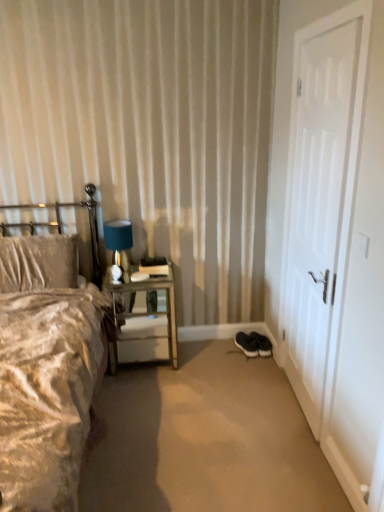
Question: Can we say white matte door at right lies outside metallic silver nightstand at left?

Choices:
 (A) no
 (B) yes

Answer: (B)

Question: From a real-world perspective, is white matte door at right under metallic silver nightstand at left?

Choices:
 (A) no
 (B) yes

Answer: (A)

Question: From a real-world perspective, is white matte door at right positioned over metallic silver nightstand at left based on gravity?

Choices:
 (A) no
 (B) yes

Answer: (B)

Question: Is the position of white matte door at right less distant than that of metallic silver nightstand at left?

Choices:
 (A) yes
 (B) no

Answer: (A)

Question: Does white matte door at right have a lesser height compared to metallic silver nightstand at left?

Choices:
 (A) yes
 (B) no

Answer: (B)

Question: Is black rubber shoes at lower right to the left or to the right of black suede sneakers at lower right, positioned as the first footwear in left-to-right order, in the image?

Choices:
 (A) left
 (B) right

Answer: (A)

Question: Is point (183, 499) positioned closer to the camera than point (243, 352)?

Choices:
 (A) farther
 (B) closer

Answer: (B)

Question: Is black rubber shoes at lower right in front of or behind black suede sneakers at lower right, positioned as the first footwear in left-to-right order, in the image?

Choices:
 (A) front
 (B) behind

Answer: (A)

Question: Choose the correct answer: Is black rubber shoes at lower right inside black suede sneakers at lower right, positioned as the first footwear in left-to-right order, or outside it?

Choices:
 (A) inside
 (B) outside

Answer: (B)

Question: From the image's perspective, is black suede sneakers at lower center, acting as the 2th footwear starting from the left, above or below blue fabric lampshade at upper left?

Choices:
 (A) above
 (B) below

Answer: (B)

Question: Is black suede sneakers at lower center, acting as the 2th footwear starting from the left, wider or thinner than blue fabric lampshade at upper left?

Choices:
 (A) wide
 (B) thin

Answer: (A)

Question: Considering their positions, is black suede sneakers at lower center, which is counted as the first footwear, starting from the right, located in front of or behind blue fabric lampshade at upper left?

Choices:
 (A) front
 (B) behind

Answer: (B)

Question: Does point (263, 338) appear closer or farther from the camera than point (115, 224)?

Choices:
 (A) closer
 (B) farther

Answer: (B)

Question: Looking at the image, does black suede sneakers at lower right, positioned as the first footwear in left-to-right order, seem bigger or smaller compared to black suede sneakers at lower center, acting as the 2th footwear starting from the left?

Choices:
 (A) small
 (B) big

Answer: (B)

Question: Considering the positions of black suede sneakers at lower right, arranged as the 2th footwear when viewed from the right, and black suede sneakers at lower center, acting as the 2th footwear starting from the left, in the image, is black suede sneakers at lower right, arranged as the 2th footwear when viewed from the right, wider or thinner than black suede sneakers at lower center, acting as the 2th footwear starting from the left,?

Choices:
 (A) thin
 (B) wide

Answer: (B)